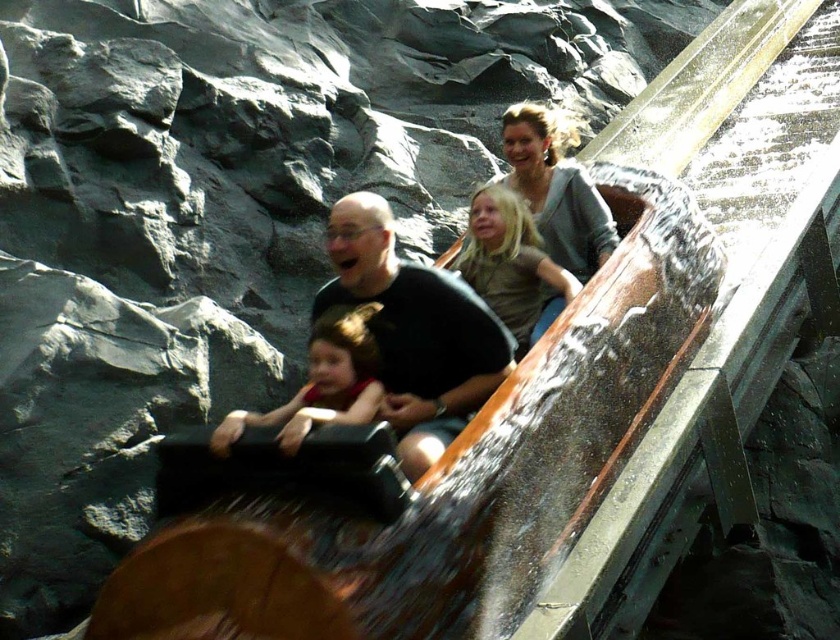
You are a photographer positioned at the front of the roller coaster. You notice two family members wearing the matte red shirt at center and the matte gray shirt at center. Since you want to capture both in the same frame, which shirt should you focus on to ensure both are visible?

The matte red shirt at center has a larger width than the matte gray shirt at center, so focusing on the matte red shirt at center would allow both to be captured in the frame since it occupies more space.

You are a photographer positioned at the origin point of the image. You want to capture a photo of the black matte shirt at center. What are the coordinates where you should aim your camera?

The black matte shirt at center is located at point coordinates of (413, 332), so you should aim your camera at those coordinates to capture it.

You are a photographer standing at the base of the roller coaster track. You want to take a photo of both the matte gray sweater at upper center and the matte gray shirt at center in the same frame. Given that your camera has a maximum focus range of 2.5 meters, will you be able to capture both subjects clearly in one shot?

The distance between the matte gray sweater at upper center and the matte gray shirt at center is 2.69 meters, which exceeds the camera focus range of 2.5 meters. Therefore, you cannot capture both subjects clearly in one shot.